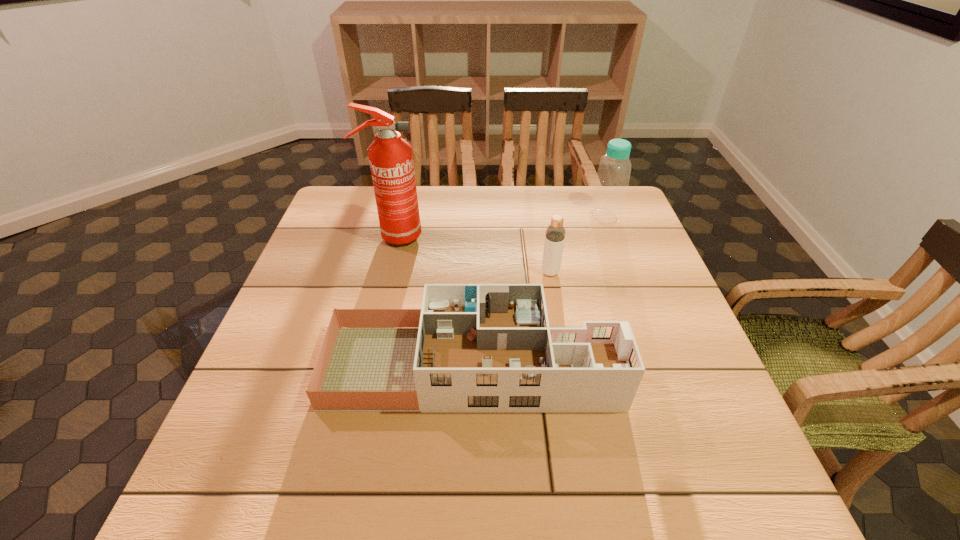
Where is `the tallest object`? This screenshot has width=960, height=540. the tallest object is located at coordinates (391, 161).

Where is `the second tallest object`? This screenshot has height=540, width=960. the second tallest object is located at coordinates (611, 184).

Locate an element on the screen. This screenshot has height=540, width=960. the rightmost object is located at coordinates click(x=611, y=184).

Identify the location of the nearer bottle. The height and width of the screenshot is (540, 960). (555, 233).

You are a GUI agent. You are given a task and a screenshot of the screen. Output one action in this format:
    pyautogui.click(x=<x>, y=<y>)
    Task: Click on the third farthest object
    
    Given the screenshot: What is the action you would take?
    pyautogui.click(x=555, y=233)

Identify the location of dollhouse. This screenshot has height=540, width=960. (472, 348).

Where is `the nearest object`? The image size is (960, 540). the nearest object is located at coordinates (472, 348).

Where is `free space located 0.300m at the nozzle of the tallest object`? This screenshot has height=540, width=960. free space located 0.300m at the nozzle of the tallest object is located at coordinates (528, 236).

This screenshot has width=960, height=540. I want to click on vacant position located on the front of the right bottle, so click(625, 273).

At what (x,y) coordinates should I click in order to perform the action: click on free location located on the back of the nearer bottle. Please return your answer as a coordinate pair (x, y). The image size is (960, 540). Looking at the image, I should click on (545, 243).